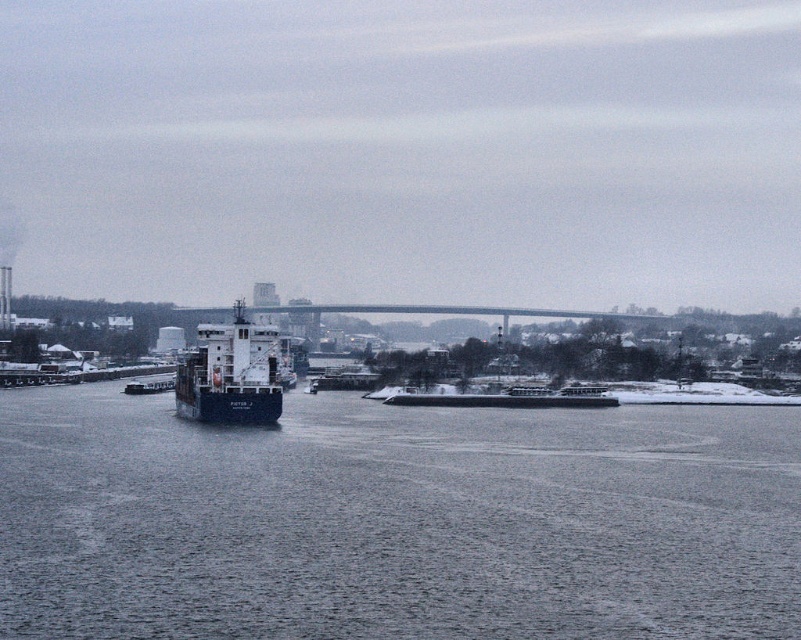
Who is more distant from viewer, (x=602, y=589) or (x=566, y=397)?

Point (x=566, y=397)

Does gray water at center have a lesser width compared to white matte barge at center?

In fact, gray water at center might be wider than white matte barge at center.

Does point (425, 628) come behind point (445, 396)?

No, it is not.

The image size is (801, 640). I want to click on gray water at center, so click(x=395, y=518).

The width and height of the screenshot is (801, 640). I want to click on gray water at center, so click(395, 518).

Does gray water at center appear on the right side of blue matte cargo ship at center?

Indeed, gray water at center is positioned on the right side of blue matte cargo ship at center.

This screenshot has width=801, height=640. What do you see at coordinates (395, 518) in the screenshot?
I see `gray water at center` at bounding box center [395, 518].

Find the location of a particular element. The width and height of the screenshot is (801, 640). gray water at center is located at coordinates (395, 518).

Which is more to the left, blue matte cargo ship at center or white matte barge at center?

blue matte cargo ship at center

Is blue matte cargo ship at center closer to the viewer compared to white matte barge at center?

Yes.

Identify the location of blue matte cargo ship at center. This screenshot has width=801, height=640. (231, 372).

Identify the location of blue matte cargo ship at center. The image size is (801, 640). click(231, 372).